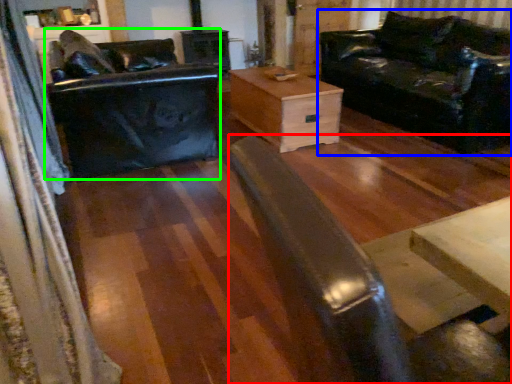
Question: Which is nearer to the wide (highlighted by a red box)? studio couch (highlighted by a blue box) or swivel chair (highlighted by a green box).

Choices:
 (A) studio couch
 (B) swivel chair

Answer: (B)